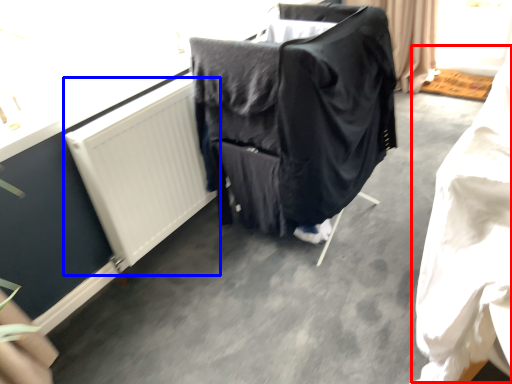
Question: Which of the following is the farthest to the observer, clothing (highlighted by a red box) or radiator (highlighted by a blue box)?

Choices:
 (A) clothing
 (B) radiator

Answer: (B)